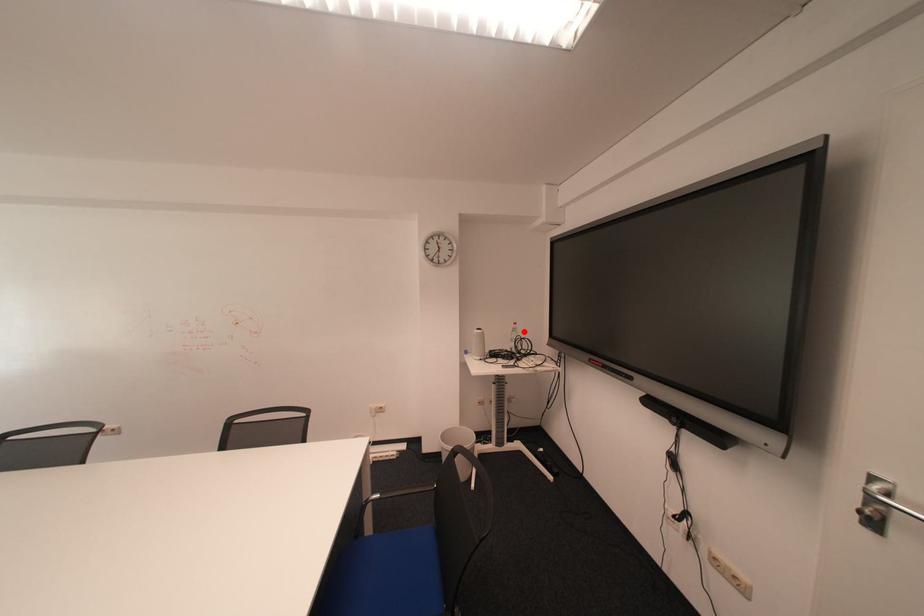
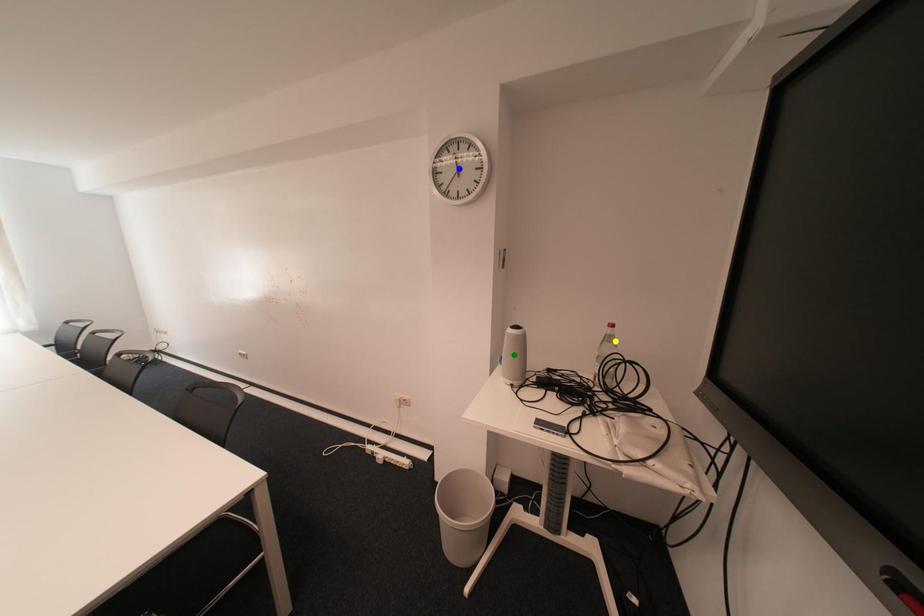
Question: I am providing you with two images of the same scene from different viewpoints. A red point is marked on the first image. You are given multiple points on the second image. In image 2, which mark is for the same physical point as the one in image 1?

Choices:
 (A) green point
 (B) yellow point
 (C) blue point

Answer: (B)